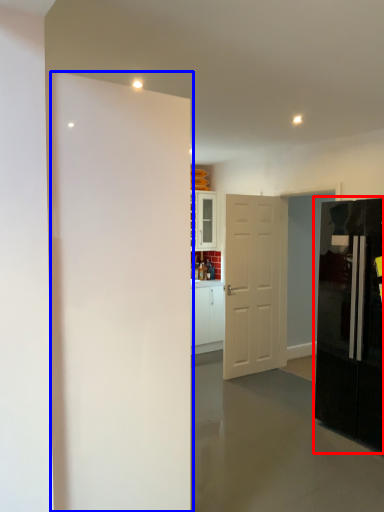
Question: Which point is closer to the camera, refrigerator (highlighted by a red box) or door (highlighted by a blue box)?

Choices:
 (A) refrigerator
 (B) door

Answer: (B)